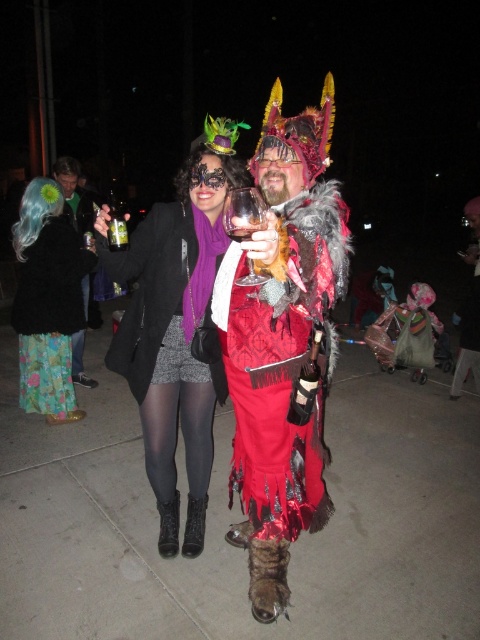
Between smooth concrete pavement at center and shiny red fabric at center, which one has more height?

With more height is shiny red fabric at center.

Does smooth concrete pavement at center have a larger size compared to shiny red fabric at center?

Correct, smooth concrete pavement at center is larger in size than shiny red fabric at center.

Who is more forward, (x=411, y=486) or (x=297, y=424)?

Positioned in front is point (x=297, y=424).

Locate an element on the screen. This screenshot has height=640, width=480. smooth concrete pavement at center is located at coordinates (240, 518).

At what (x,y) coordinates should I click in order to perform the action: click on matte black coat at center. Please return your answer as a coordinate pair (x, y). The width and height of the screenshot is (480, 640). Looking at the image, I should click on (175, 336).

Between matte black coat at center and clear plastic cup at upper left, which one is positioned lower?

matte black coat at center

What do you see at coordinates (175, 336) in the screenshot?
I see `matte black coat at center` at bounding box center [175, 336].

The height and width of the screenshot is (640, 480). Find the location of `matte black coat at center`. matte black coat at center is located at coordinates (175, 336).

Between smooth concrete pavement at center and matte black coat at center, which one is positioned higher?

matte black coat at center is above.

Is point (160, 632) positioned in front of point (113, 264)?

Yes, point (160, 632) is closer to viewer.

Image resolution: width=480 pixels, height=640 pixels. Identify the location of smooth concrete pavement at center. (240, 518).